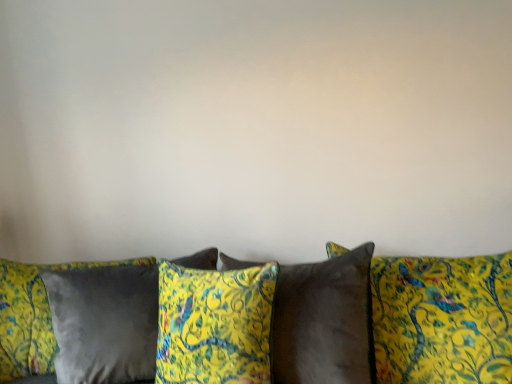
Question: Considering the positions of velvet yellow pillows at center and velvet yellow pillow at center, which ranks as the 3th pillow in left-to-right order, in the image, is velvet yellow pillows at center taller or shorter than velvet yellow pillow at center, which ranks as the 3th pillow in left-to-right order,?

Choices:
 (A) tall
 (B) short

Answer: (B)

Question: Considering the relative positions of velvet yellow pillows at center and velvet yellow pillow at center, positioned as the second pillow in right-to-left order, in the image provided, is velvet yellow pillows at center to the left or to the right of velvet yellow pillow at center, positioned as the second pillow in right-to-left order,?

Choices:
 (A) left
 (B) right

Answer: (A)

Question: Considering the real-world distances, which object is farthest from the velvet yellow pillow at center, which ranks as the 2th pillow in left-to-right order?

Choices:
 (A) velvet yellow pillows at center
 (B) velvet yellow pillow at center, which ranks as the 3th pillow in left-to-right order
 (C) satin gray pillow at lower left, the 4th pillow positioned from the right
 (D) satin brown pillow at center, which appears as the 1th pillow when viewed from the right

Answer: (A)

Question: Which object is the closest to the velvet yellow pillow at center, which ranks as the 3th pillow in left-to-right order?

Choices:
 (A) satin brown pillow at center, which appears as the 1th pillow when viewed from the right
 (B) velvet yellow pillows at center
 (C) velvet yellow pillow at center, which ranks as the 2th pillow in left-to-right order
 (D) satin gray pillow at lower left, the first pillow viewed from the left

Answer: (A)